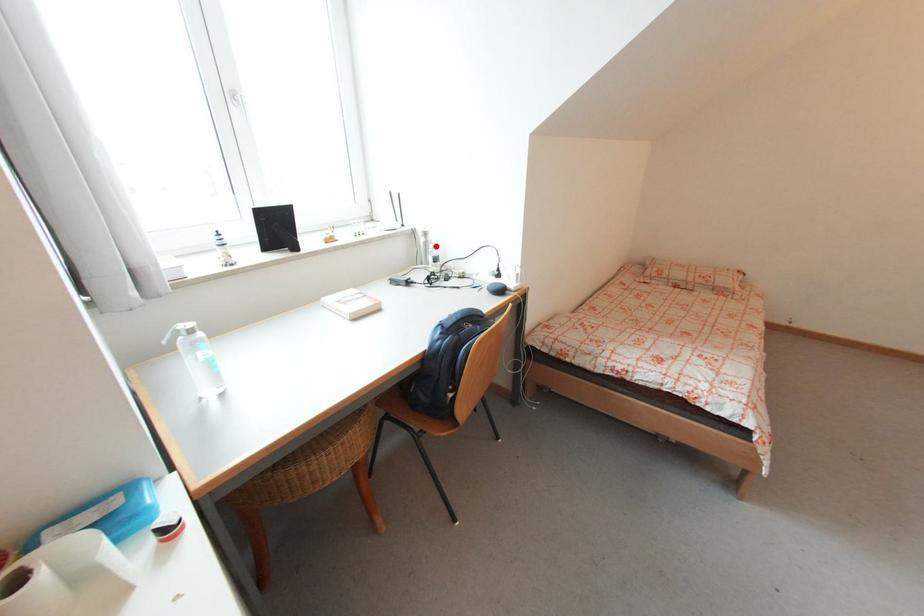
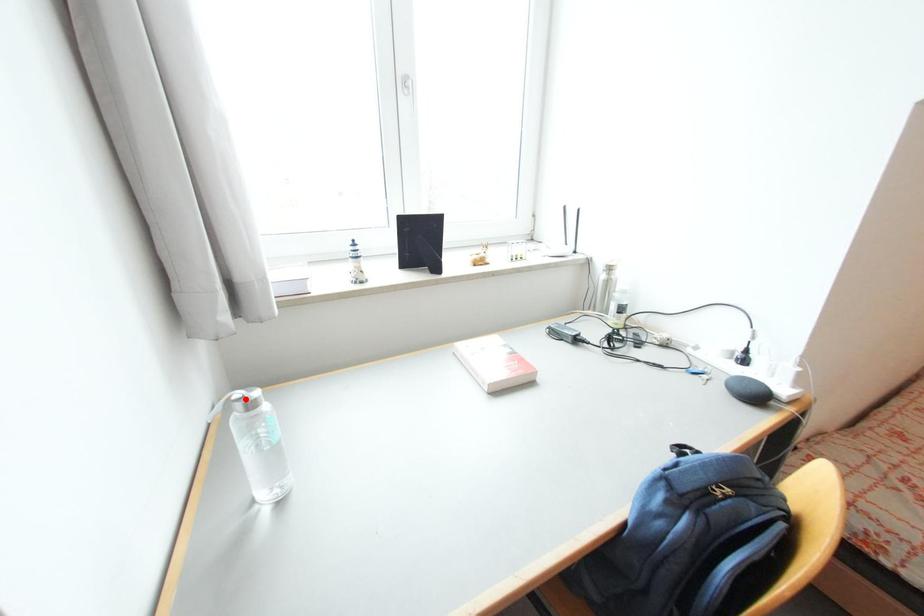
I am providing you with two images of the same scene from different viewpoints. A red point is marked on the first image and another point is marked on the second image. Is the red point in image1 aligned with the point shown in image2?

No